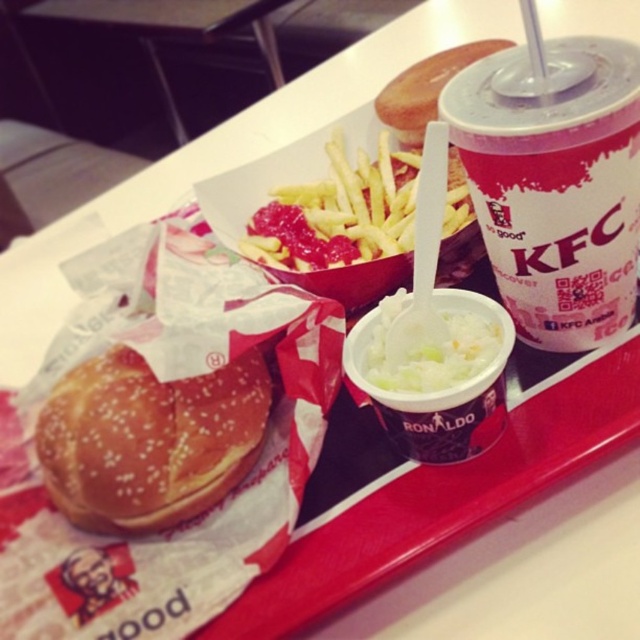
Question: Which point appears farthest from the camera in this image?

Choices:
 (A) (401, 236)
 (B) (461, 316)
 (C) (499, 212)

Answer: (A)

Question: Can you confirm if white paper cup with straw at upper right is wider than yellow crispy french fries at center?

Choices:
 (A) no
 (B) yes

Answer: (A)

Question: Which is nearer to the yellow crispy french fries at center?

Choices:
 (A) white creamy sauce at center
 (B) white paper cup with straw at upper right
 (C) slightly toasted bun at center-left

Answer: (B)

Question: Does yellow crispy french fries at center appear on the left side of white creamy sauce at center?

Choices:
 (A) no
 (B) yes

Answer: (B)

Question: Among these objects, which one is nearest to the camera?

Choices:
 (A) slightly toasted bun at center-left
 (B) white creamy sauce at center
 (C) white paper cup with straw at upper right

Answer: (C)

Question: Is yellow crispy french fries at center below white creamy sauce at center?

Choices:
 (A) no
 (B) yes

Answer: (A)